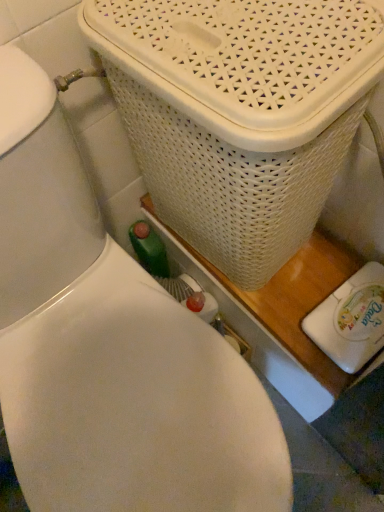
Where is `free space to the back side of white plastic toilet brush at lower right`? This screenshot has width=384, height=512. free space to the back side of white plastic toilet brush at lower right is located at coordinates (320, 266).